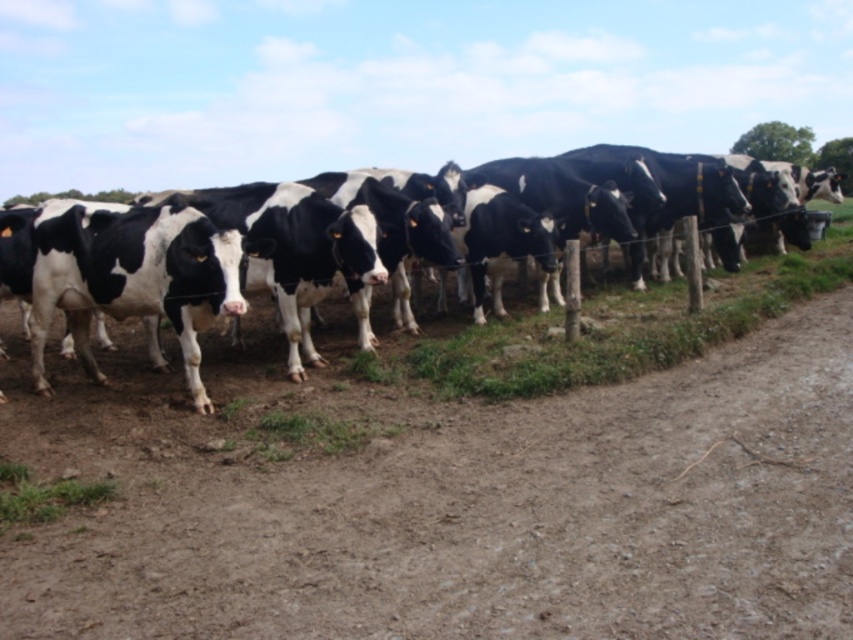
Question: Among these objects, which one is nearest to the camera?

Choices:
 (A) black and white cow at center
 (B) brown sandy dirt at lower center

Answer: (B)

Question: Which object appears closest to the camera in this image?

Choices:
 (A) brown sandy dirt at lower center
 (B) black and white cow at center

Answer: (A)

Question: Is brown sandy dirt at lower center wider than black and white cow at center?

Choices:
 (A) yes
 (B) no

Answer: (A)

Question: Can you confirm if brown sandy dirt at lower center is positioned above black and white cow at center?

Choices:
 (A) no
 (B) yes

Answer: (A)

Question: Which of the following is the farthest from the observer?

Choices:
 (A) (674, 308)
 (B) (260, 611)

Answer: (A)

Question: Can you confirm if brown sandy dirt at lower center is positioned below black and white cow at center?

Choices:
 (A) yes
 (B) no

Answer: (A)